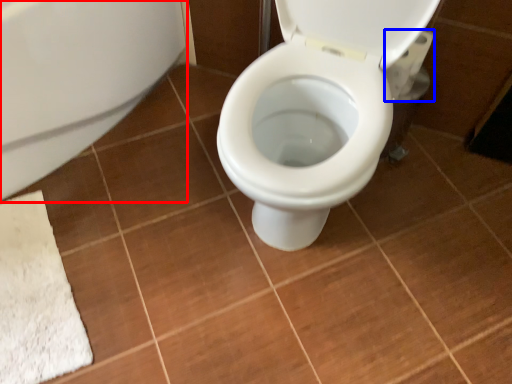
Question: Which object appears farthest to the camera in this image, bath (highlighted by a red box) or toilet paper (highlighted by a blue box)?

Choices:
 (A) bath
 (B) toilet paper

Answer: (B)